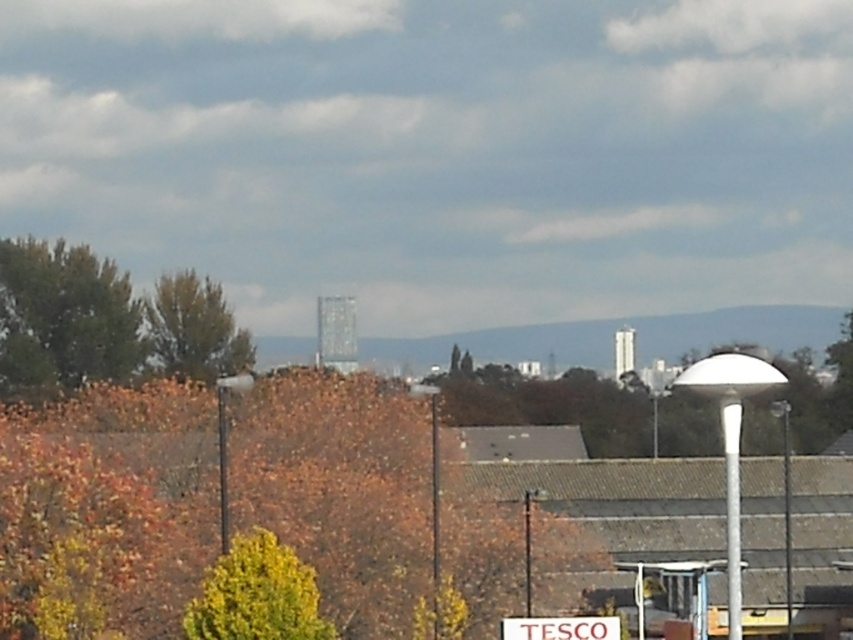
You are a photographer planning to capture a shot of the orange autumn leaves at lower left and the green leafy tree at lower left. Based on their sizes in the scene, which one would appear larger in your photo?

The orange autumn leaves at lower left would appear larger in the photo since they are bigger than the green leafy tree at lower left.

You are a pedestrian standing in the middle of the image. You see the green leafy tree at left and the green leafy tree at lower left. Which tree is positioned more to your left side?

The green leafy tree at left is positioned more to the left side than the green leafy tree at lower left.